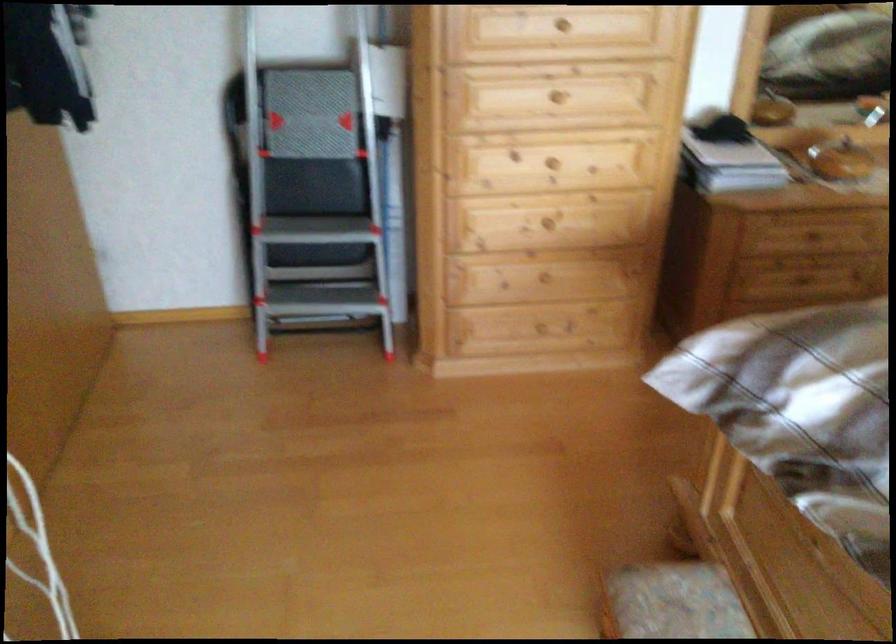
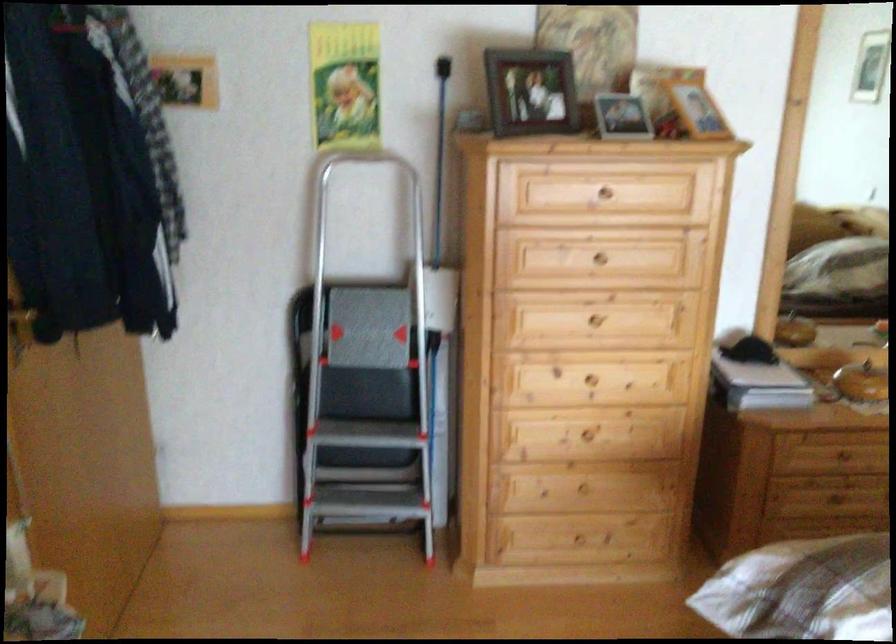
Question: The first image is from the beginning of the video and the second image is from the end. How did the camera likely rotate when shooting the video?

Choices:
 (A) Left
 (B) Right
 (C) Up
 (D) Down

Answer: (C)